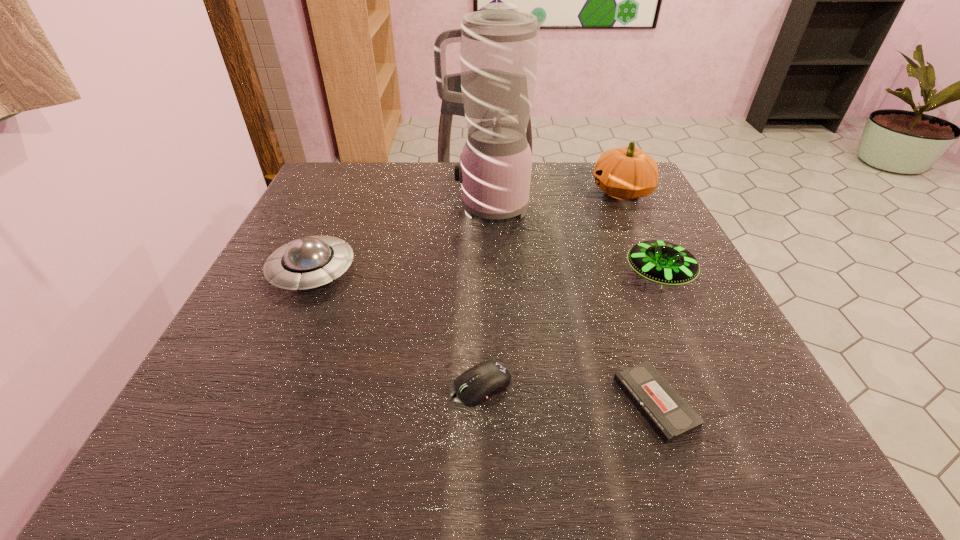
Where is `vacant space that is in between the food processor and the videotape`? vacant space that is in between the food processor and the videotape is located at coordinates (571, 305).

At what (x,y) coordinates should I click in order to perform the action: click on vacant point located between the right saucer and the leftmost object. Please return your answer as a coordinate pair (x, y). Image resolution: width=960 pixels, height=540 pixels. Looking at the image, I should click on (486, 273).

Where is `object that can be found as the fifth closest to the computer equipment`? Image resolution: width=960 pixels, height=540 pixels. object that can be found as the fifth closest to the computer equipment is located at coordinates (625, 173).

Locate an element on the screen. The height and width of the screenshot is (540, 960). the third closest object to the right saucer is located at coordinates (499, 45).

You are a GUI agent. You are given a task and a screenshot of the screen. Output one action in this format:
    pyautogui.click(x=<x>, y=<y>)
    Task: Click on the vacant area that satisfies the following two spatial constraints: 1. on the side of the gourd with the carved face; 2. on the front side of the left saucer
    The width and height of the screenshot is (960, 540).
    Given the screenshot: What is the action you would take?
    pyautogui.click(x=660, y=272)

The height and width of the screenshot is (540, 960). In order to click on blank space that satisfies the following two spatial constraints: 1. on the base of the food processor near the control knob; 2. on the left side of the videotape in this screenshot , I will do `click(491, 402)`.

This screenshot has width=960, height=540. Identify the location of vacant space that satisfies the following two spatial constraints: 1. on the base of the tallest object near the control knob; 2. on the front side of the left saucer. (488, 272).